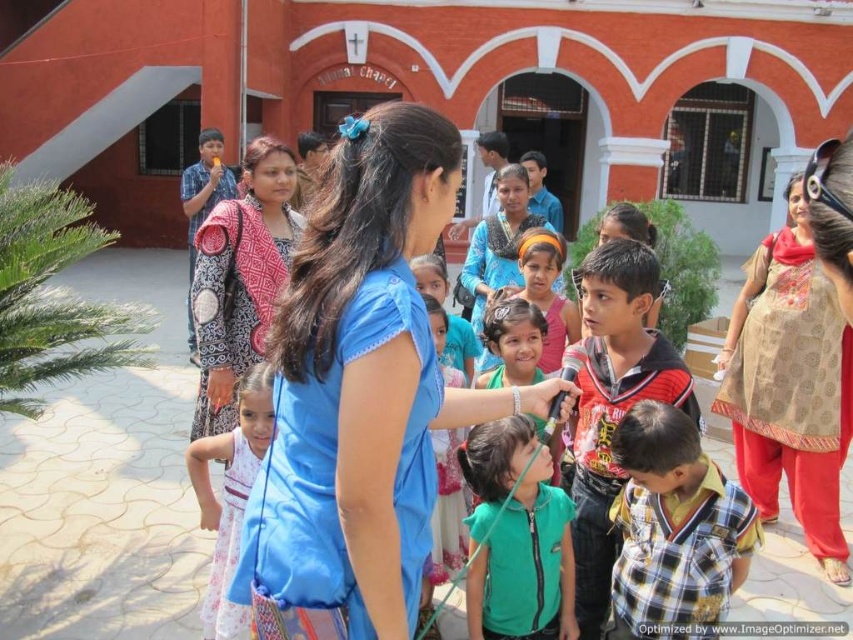
Question: Which object is positioned farthest from the striped cotton shirt at center?

Choices:
 (A) green matte vest at center
 (B) plaid cotton shirt at center

Answer: (A)

Question: Which of the following is the closest to the observer?

Choices:
 (A) plaid cotton shirt at center
 (B) patterned fabric scarf at center
 (C) striped cotton shirt at center
 (D) blue fabric dress at center

Answer: (D)

Question: Does beige patterned kurta at center have a smaller size compared to green matte vest at center?

Choices:
 (A) yes
 (B) no

Answer: (B)

Question: Is patterned fabric scarf at center smaller than white printed dress at center?

Choices:
 (A) no
 (B) yes

Answer: (A)

Question: Does blue fabric dress at center have a lesser width compared to matte pink dress at center?

Choices:
 (A) no
 (B) yes

Answer: (A)

Question: Which is farther from the green matte vest at center?

Choices:
 (A) blue fabric dress at center
 (B) patterned fabric scarf at center
 (C) matte pink dress at center
 (D) plaid cotton shirt at center

Answer: (B)